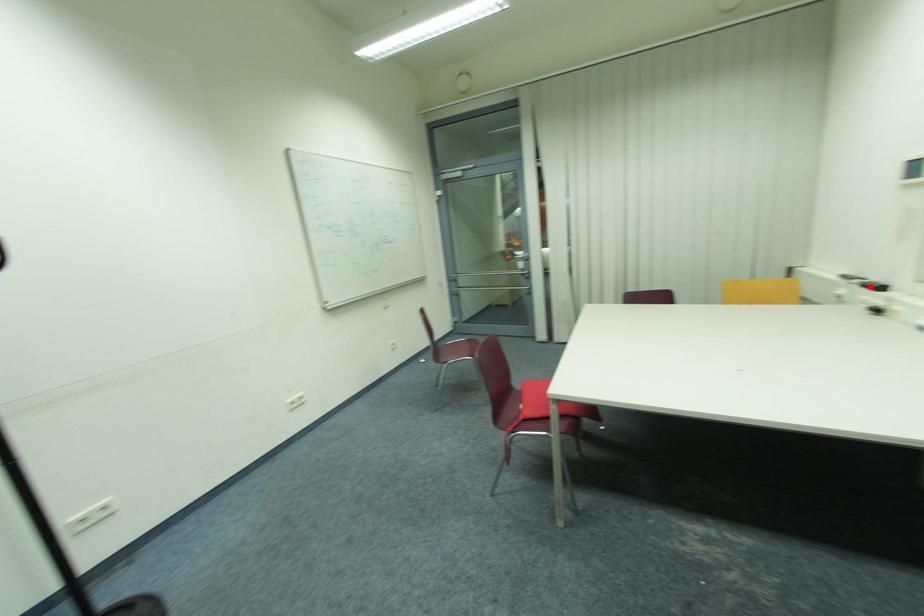
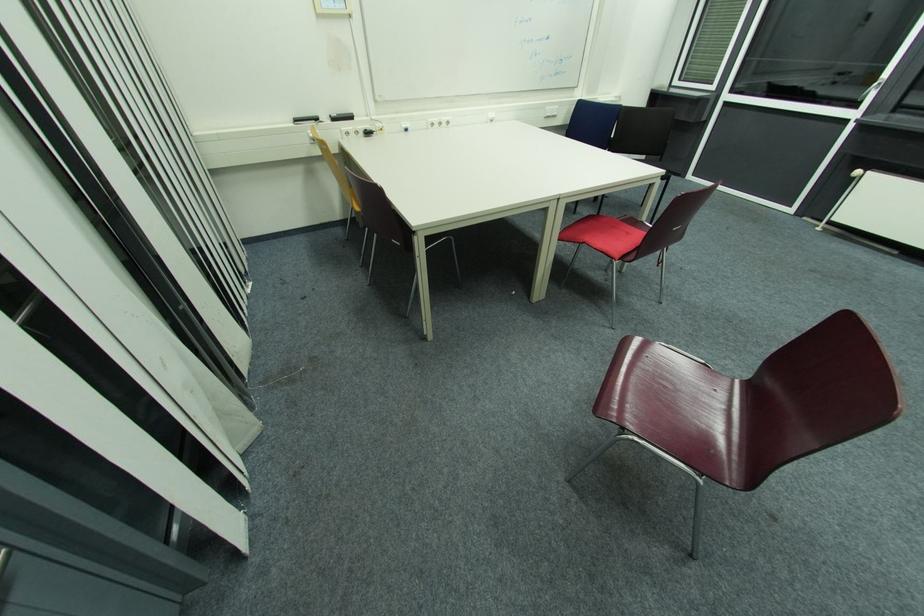
Question: I am providing you with two images of the same scene from different viewpoints. A red point is marked on the first image. Is the red point's position out of view in image 2?

Choices:
 (A) Yes
 (B) No

Answer: (B)